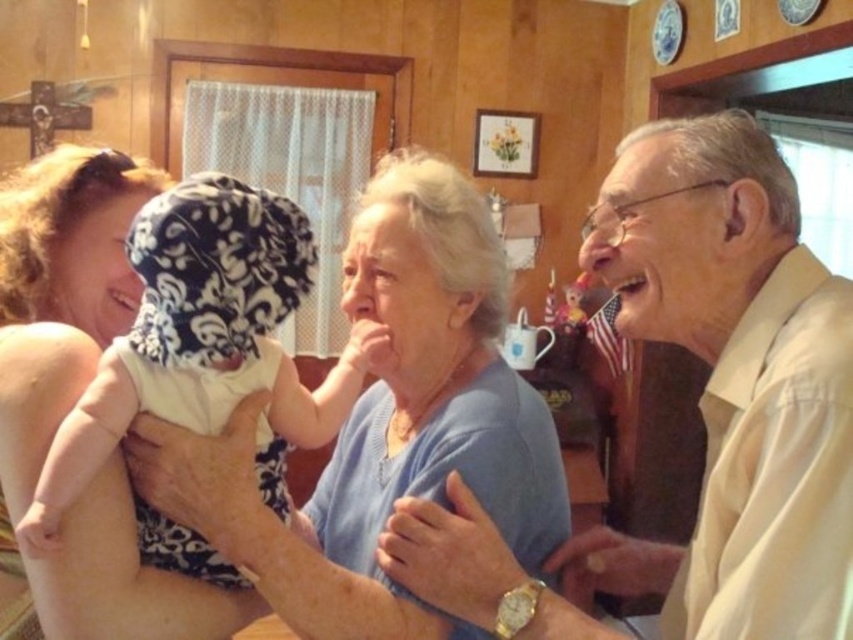
Is light beige shirt at center positioned before white cotton baby at center?

Yes, light beige shirt at center is in front of white cotton baby at center.

Does light beige shirt at center have a larger size compared to white cotton baby at center?

Yes, light beige shirt at center is bigger than white cotton baby at center.

Between point (779, 291) and point (180, 387), which one is positioned in front?

Point (779, 291)

Image resolution: width=853 pixels, height=640 pixels. Find the location of `light beige shirt at center`. light beige shirt at center is located at coordinates (733, 381).

Does blue knit sweater at center have a greater width compared to smooth skin mouth at upper right?

Correct, the width of blue knit sweater at center exceeds that of smooth skin mouth at upper right.

Is blue knit sweater at center shorter than smooth skin mouth at upper right?

No, blue knit sweater at center is not shorter than smooth skin mouth at upper right.

The image size is (853, 640). I want to click on blue knit sweater at center, so click(x=386, y=422).

Is blue knit sweater at center bigger than white cotton baby at center?

Yes, blue knit sweater at center is bigger than white cotton baby at center.

Between point (209, 451) and point (270, 490), which one is positioned behind?

The point (270, 490) is behind.

The image size is (853, 640). Identify the location of blue knit sweater at center. (386, 422).